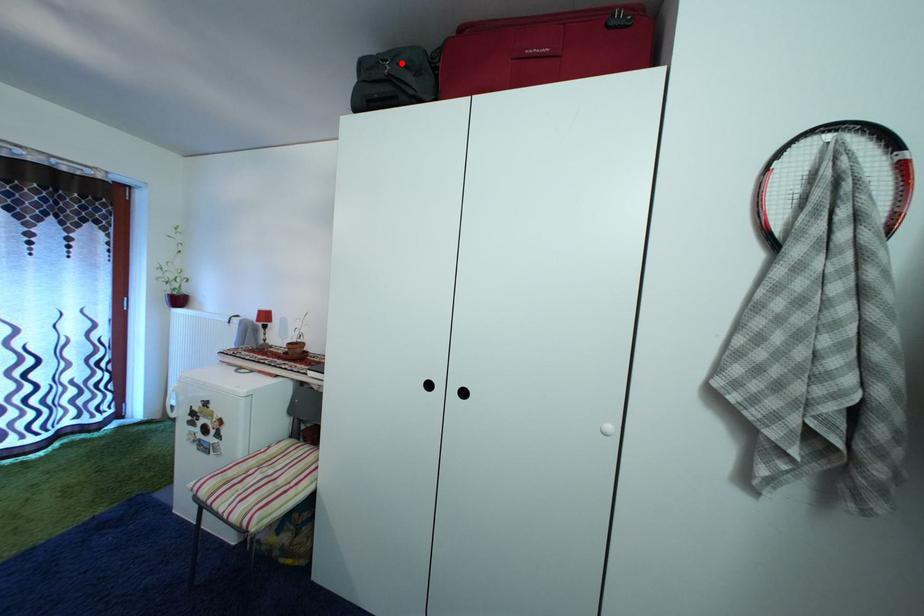
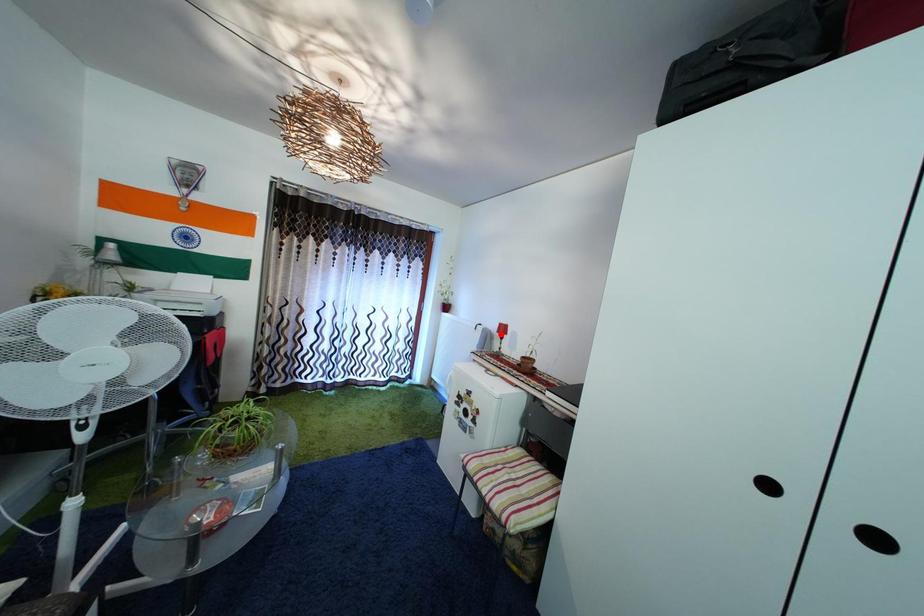
I am providing you with two images of the same scene from different viewpoints. A red point is marked on the first image and another point is marked on the second image. Do the highlighted points in image1 and image2 indicate the same real-world spot?

No